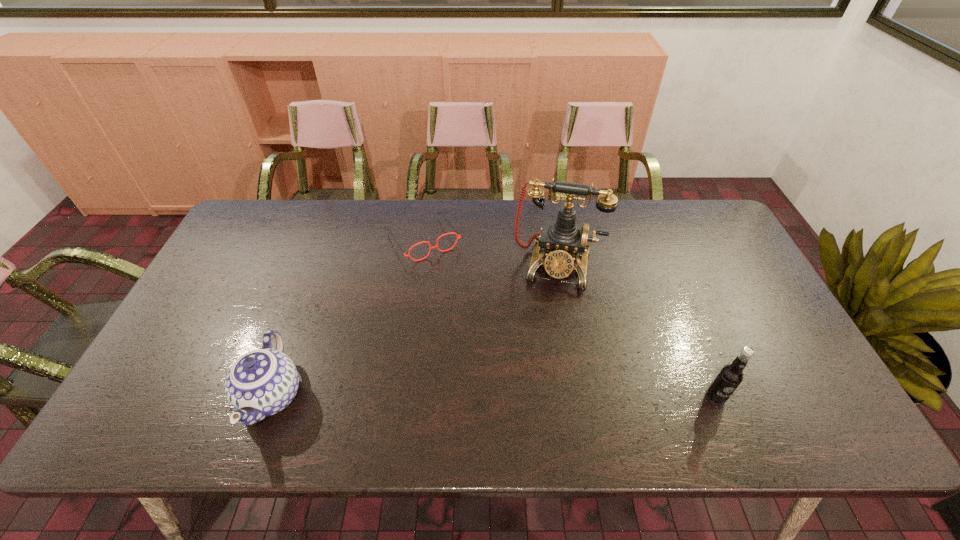
Identify the location of the leftmost object. (262, 382).

Locate an element on the screen. The width and height of the screenshot is (960, 540). chinaware is located at coordinates (262, 382).

This screenshot has width=960, height=540. I want to click on root beer, so click(x=730, y=376).

Locate an element on the screen. the second tallest object is located at coordinates (730, 376).

Find the location of `the shortest object`. the shortest object is located at coordinates (436, 246).

Image resolution: width=960 pixels, height=540 pixels. I want to click on spectacles, so click(436, 246).

You are a GUI agent. You are given a task and a screenshot of the screen. Output one action in this format:
    pyautogui.click(x=<x>, y=<y>)
    Task: Click on the tallest object
    This screenshot has width=960, height=540.
    Given the screenshot: What is the action you would take?
    pyautogui.click(x=562, y=240)

What are the coordinates of `telephone` in the screenshot? It's located at (562, 240).

I want to click on vacant space located on the front-facing side of the shortest object, so click(x=468, y=303).

Where is `vacant space situated on the front-facing side of the shortest object`? The image size is (960, 540). vacant space situated on the front-facing side of the shortest object is located at coordinates (460, 292).